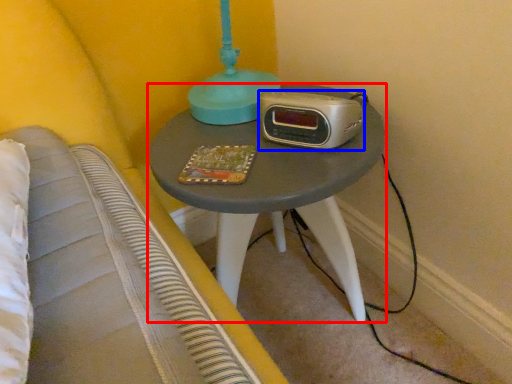
Question: Which object appears closest to the camera in this image, nightstand (highlighted by a red box) or stereo (highlighted by a blue box)?

Choices:
 (A) nightstand
 (B) stereo

Answer: (A)